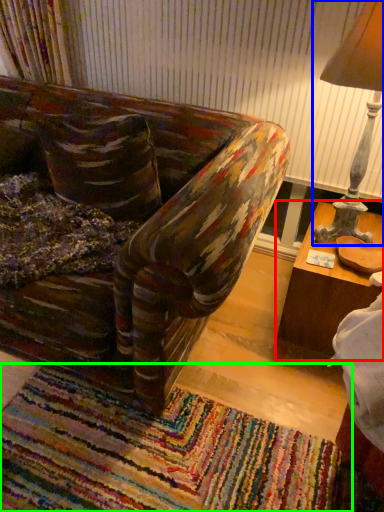
Question: Based on their relative distances, which object is nearer to table (highlighted by a red box)? Choose from table lamp (highlighted by a blue box) and mat (highlighted by a green box).

Choices:
 (A) table lamp
 (B) mat

Answer: (A)